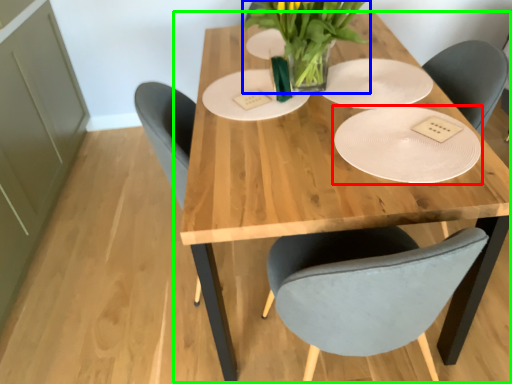
Question: Which object is positioned farthest from plate (highlighted by a red box)? Select from floral arrangement (highlighted by a blue box) and table (highlighted by a green box).

Choices:
 (A) floral arrangement
 (B) table

Answer: (A)